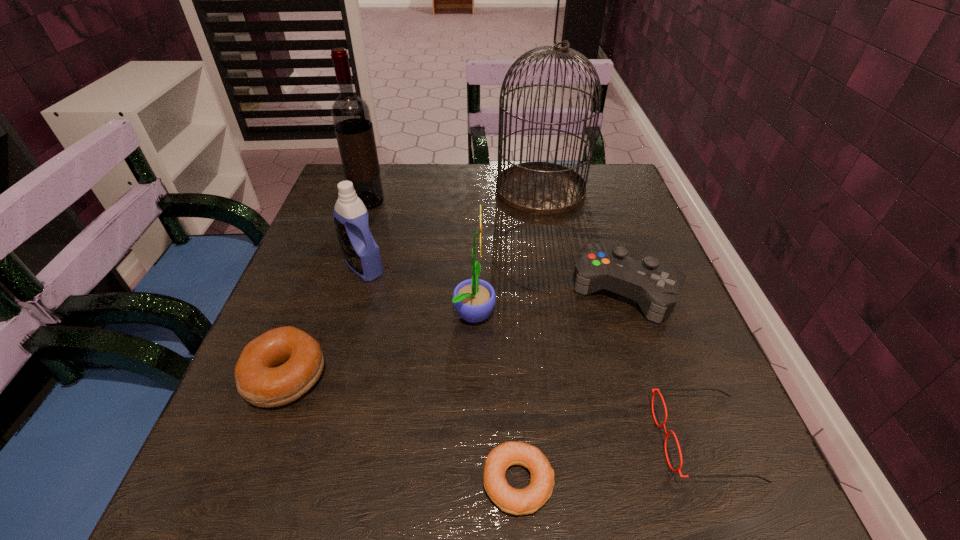
At what (x,y) coordinates should I click in order to perform the action: click on object that is at the far left corner. Please return your answer as a coordinate pair (x, y). Looking at the image, I should click on (351, 116).

This screenshot has height=540, width=960. Identify the location of object that is at the far right corner. (542, 188).

Find the location of a particular element. The image size is (960, 540). object that is at the near right corner is located at coordinates (656, 390).

At what (x,y) coordinates should I click in order to perform the action: click on vacant region at the far edge of the desktop. Please return your answer as a coordinate pair (x, y). Looking at the image, I should click on (422, 171).

In the image, there is a desktop. Where is `free space at the near edge`? Image resolution: width=960 pixels, height=540 pixels. free space at the near edge is located at coordinates (328, 474).

I want to click on free space at the left edge, so click(x=220, y=425).

Locate an element on the screen. free space at the right edge of the desktop is located at coordinates (588, 243).

In the image, there is a desktop. At what (x,y) coordinates should I click in order to perform the action: click on free space at the near right corner. Please return your answer as a coordinate pair (x, y). Image resolution: width=960 pixels, height=540 pixels. Looking at the image, I should click on (730, 492).

This screenshot has width=960, height=540. I want to click on blank region between the spectacles and the sunflower, so click(x=588, y=375).

Find the location of a particular element. The width and height of the screenshot is (960, 540). unoccupied area between the shorter bagel and the sunflower is located at coordinates (496, 397).